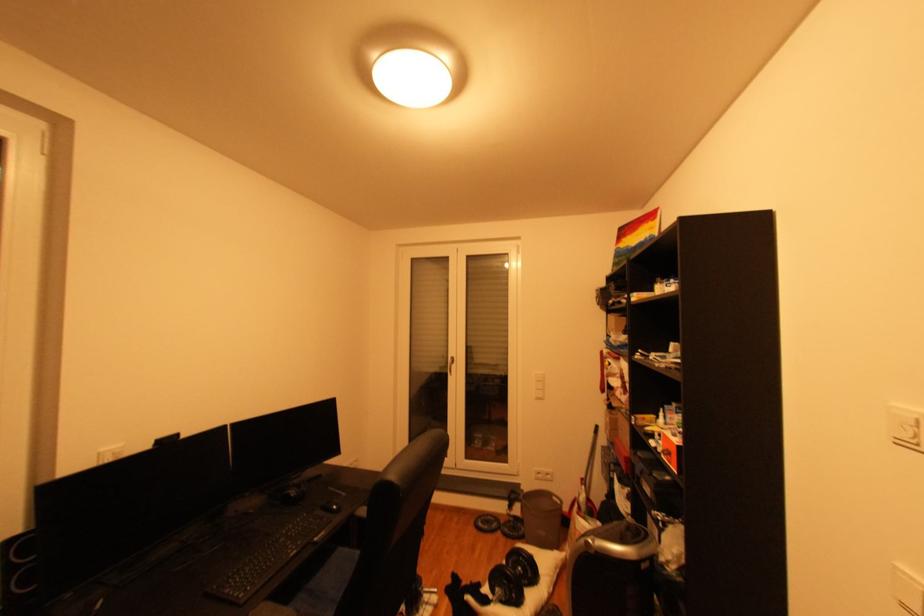
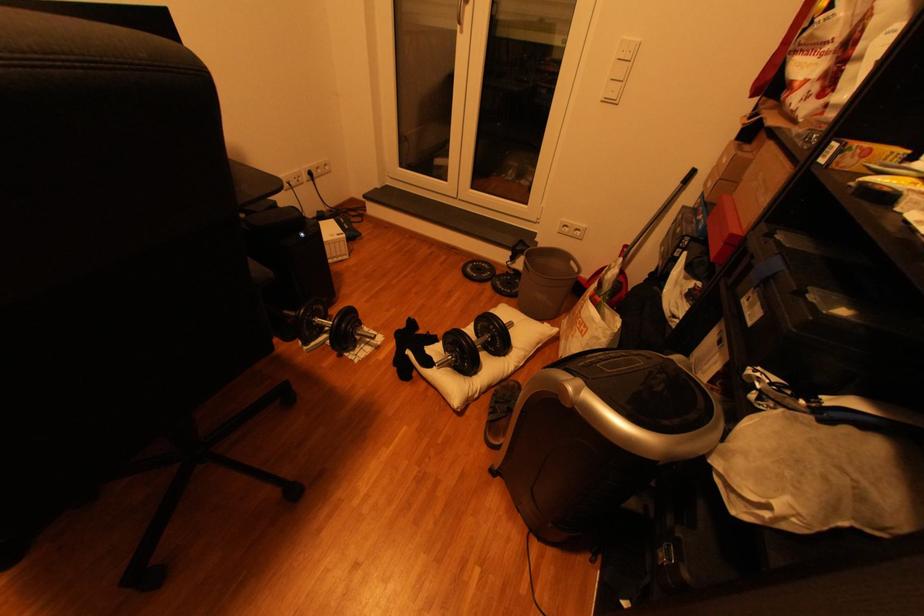
Locate, in the second image, the point that corresponds to point (546, 399) in the first image.

(614, 100)